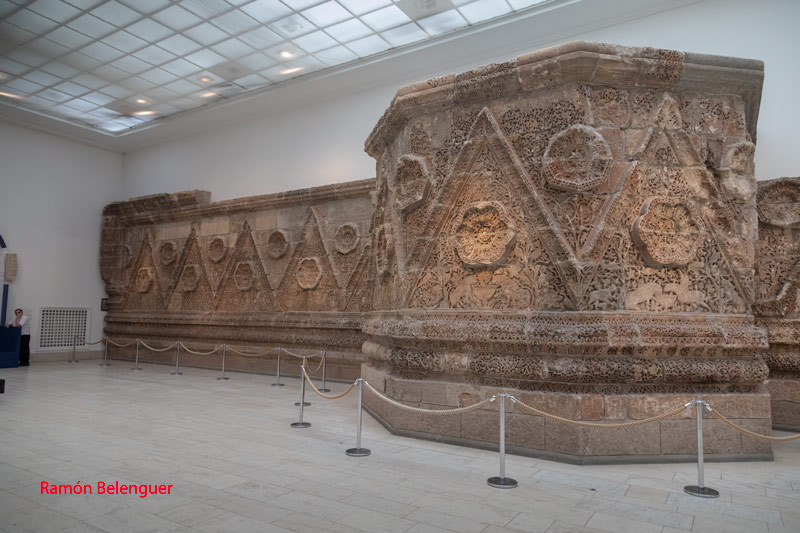
At what (x,y) coordinates should I click in order to perform the action: click on ceiling tile. Please return your answer as a coordinate pair (x, y). Looking at the image, I should click on click(x=57, y=79), click(x=157, y=76).